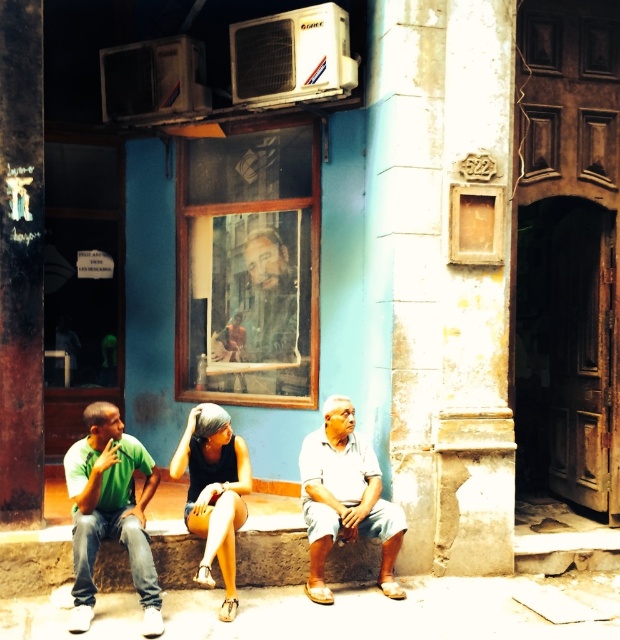
You are a tailor who needs to determine which item requires more fabric between the green matte shirt at left and the light blue cotton shorts at lower center. Based on their sizes, which one would need more fabric?

The green matte shirt at left is bigger than the light blue cotton shorts at lower center, so it would require more fabric.

You are a photographer standing at the entrance of the turquoise building. You want to take a photo of the green matte shirt at left. Where should you position yourself to capture it in the frame?

The green matte shirt at left is located at point [110,512], so you should position yourself to the left side of the scene to capture it in the frame.

You are a photographer standing 10 feet away from the two people in the scene. You want to take a photo that includes both the matte black tank top at center and the green matte shirt at left. What is the minimum distance you need to move backward to ensure both subjects are fully in frame?

The distance between the matte black tank top at center and the green matte shirt at left is 4.47 inches. To include both in the frame, you need to move back until the distance between them in the photo is within your camera lens field of view. Assuming a standard lens with a 50mm focal length, moving back to approximately 12 feet would ensure both subjects are fully captured.